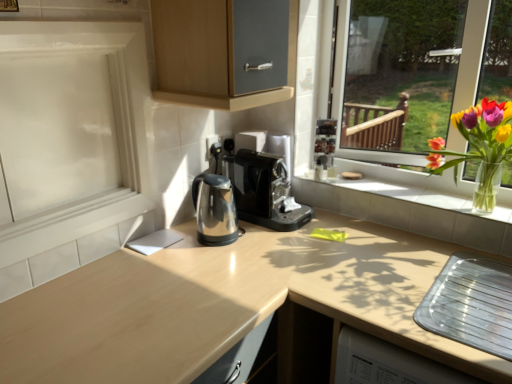
Question: Can you confirm if polished metallic kettle at center is taller than black plastic coffee machine at center?

Choices:
 (A) no
 (B) yes

Answer: (A)

Question: Is polished metallic kettle at center completely or partially outside of black plastic coffee machine at center?

Choices:
 (A) yes
 (B) no

Answer: (A)

Question: Does polished metallic kettle at center lie behind black plastic coffee machine at center?

Choices:
 (A) yes
 (B) no

Answer: (B)

Question: Would you consider polished metallic kettle at center to be distant from black plastic coffee machine at center?

Choices:
 (A) no
 (B) yes

Answer: (A)

Question: Is polished metallic kettle at center positioned with its back to black plastic coffee machine at center?

Choices:
 (A) no
 (B) yes

Answer: (A)

Question: From the image's perspective, is translucent glass vase at right above or below white glossy screen door at left?

Choices:
 (A) above
 (B) below

Answer: (B)

Question: Does point (477, 203) appear closer or farther from the camera than point (89, 69)?

Choices:
 (A) closer
 (B) farther

Answer: (B)

Question: Considering the positions of translucent glass vase at right and white glossy screen door at left in the image, is translucent glass vase at right taller or shorter than white glossy screen door at left?

Choices:
 (A) short
 (B) tall

Answer: (A)

Question: Is translucent glass vase at right situated inside white glossy screen door at left or outside?

Choices:
 (A) inside
 (B) outside

Answer: (B)

Question: Is translucent glass vase at right situated inside polished metallic kettle at center or outside?

Choices:
 (A) inside
 (B) outside

Answer: (B)

Question: In terms of height, does translucent glass vase at right look taller or shorter compared to polished metallic kettle at center?

Choices:
 (A) short
 (B) tall

Answer: (B)

Question: In the image, is translucent glass vase at right positioned in front of or behind polished metallic kettle at center?

Choices:
 (A) front
 (B) behind

Answer: (A)

Question: From the image's perspective, is translucent glass vase at right positioned above or below polished metallic kettle at center?

Choices:
 (A) below
 (B) above

Answer: (B)

Question: Which is correct: white tile window sill at center is inside black plastic coffee machine at center, or outside of it?

Choices:
 (A) inside
 (B) outside

Answer: (B)

Question: From a real-world perspective, is white tile window sill at center above or below black plastic coffee machine at center?

Choices:
 (A) above
 (B) below

Answer: (B)